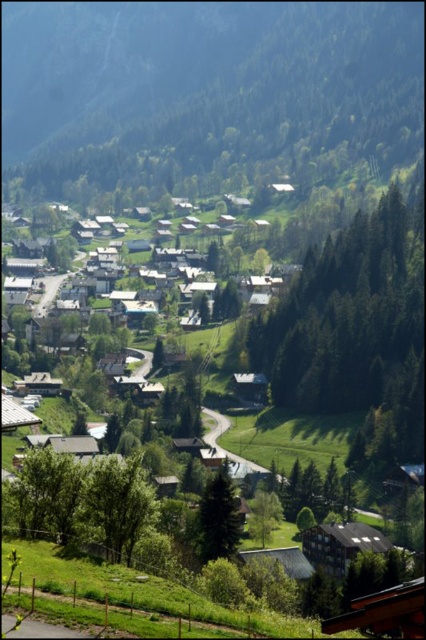
Between green textured mountain at center and green leafy tree at lower left, which one appears on the left side from the viewer's perspective?

Positioned to the left is green textured mountain at center.

Between green textured mountain at center and green leafy tree at lower left, which one appears on the right side from the viewer's perspective?

green leafy tree at lower left is more to the right.

Where is `green textured mountain at center`? green textured mountain at center is located at coordinates (207, 93).

From the picture: Does green textured mountain at center appear under green leafy tree at lower center?

Incorrect, green textured mountain at center is not positioned below green leafy tree at lower center.

Who is higher up, green textured mountain at center or green leafy tree at lower center?

green textured mountain at center is above.

Where is `green textured mountain at center`? green textured mountain at center is located at coordinates (207, 93).

What are the coordinates of `green textured mountain at center` in the screenshot? It's located at (207, 93).

Is green textured mountain at center above green leafy tree at center?

Yes.

Between point (5, 150) and point (409, 333), which one is positioned in front?

Point (409, 333) is in front.

The width and height of the screenshot is (426, 640). Identify the location of green textured mountain at center. (207, 93).